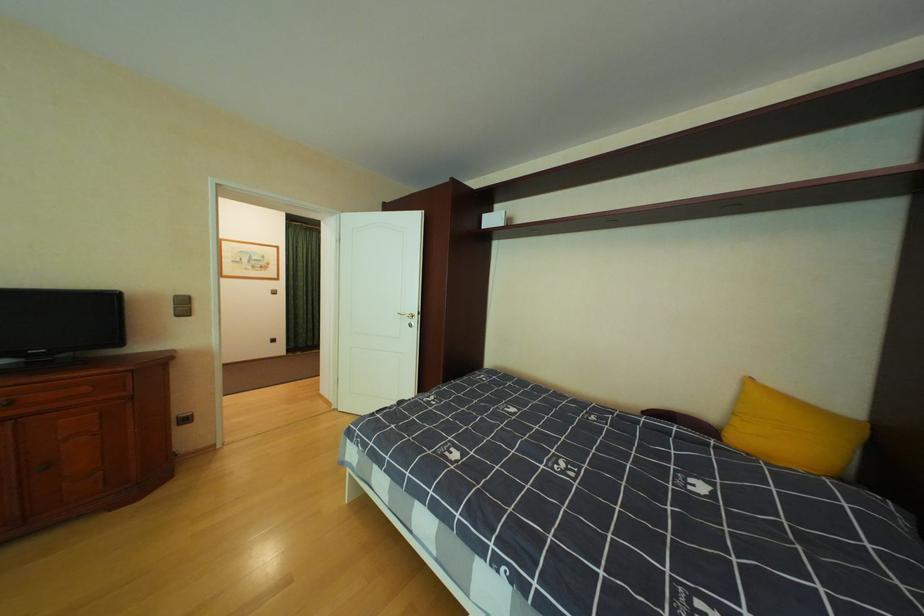
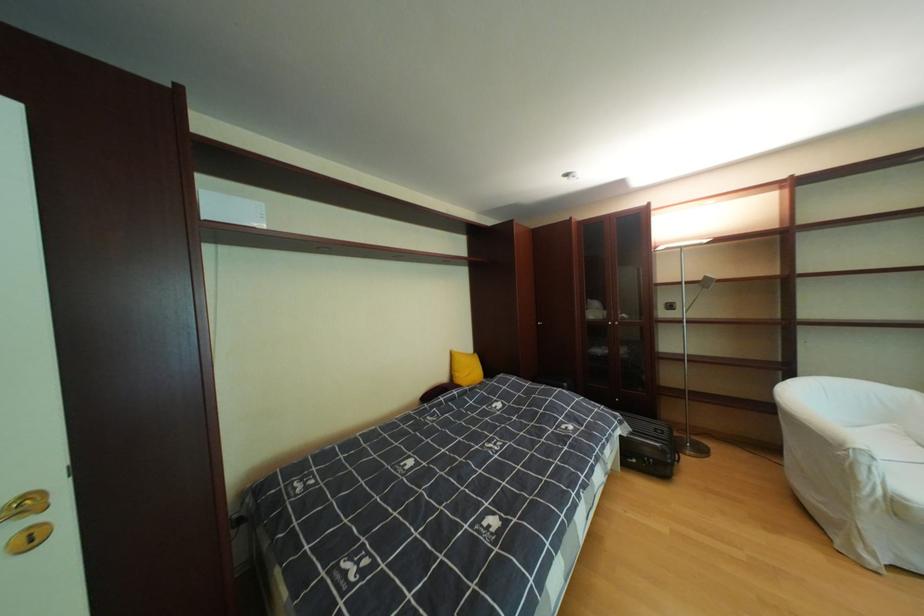
Find the pixel in the second image that matches (x=423, y=326) in the first image.

(43, 541)